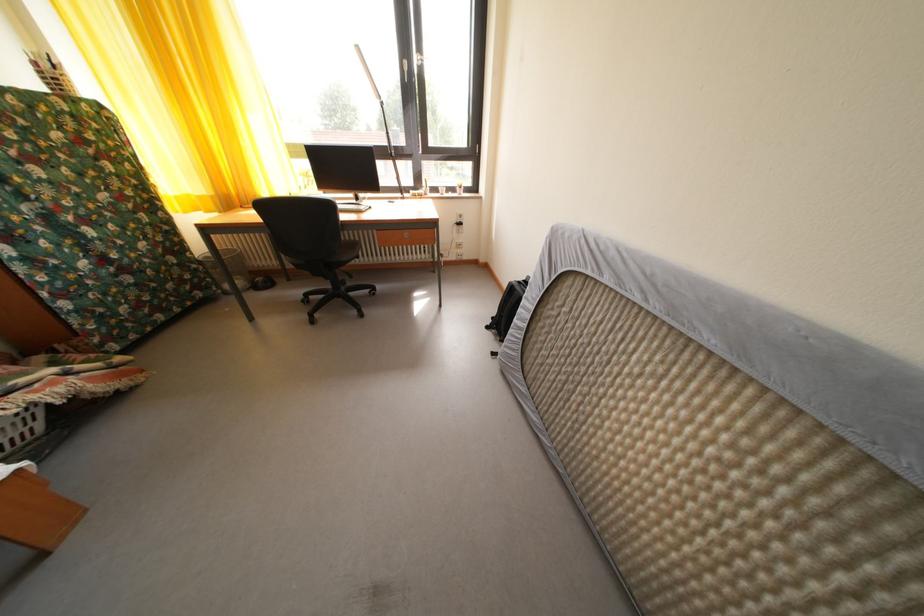
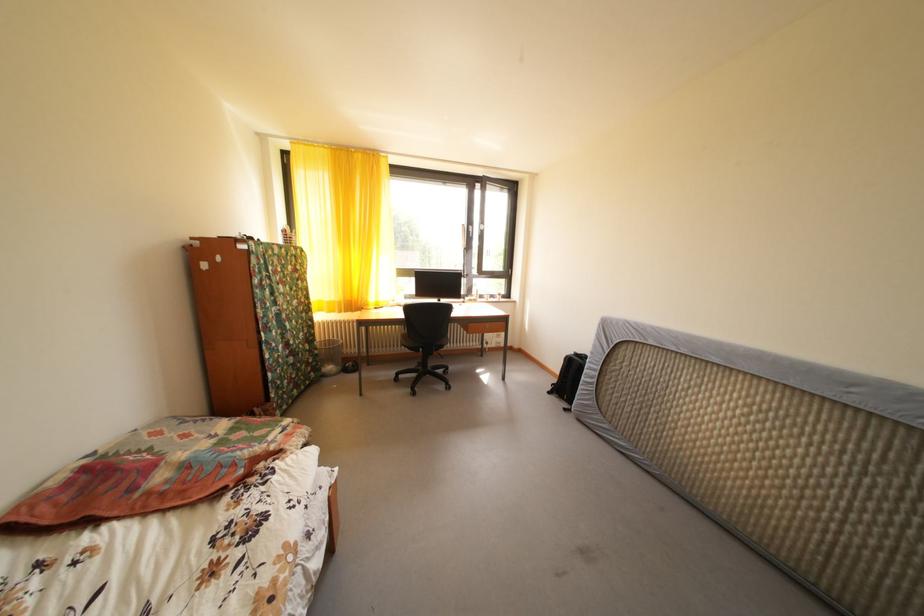
Find the pixel in the second image that matches point (188, 272) in the first image.

(320, 357)